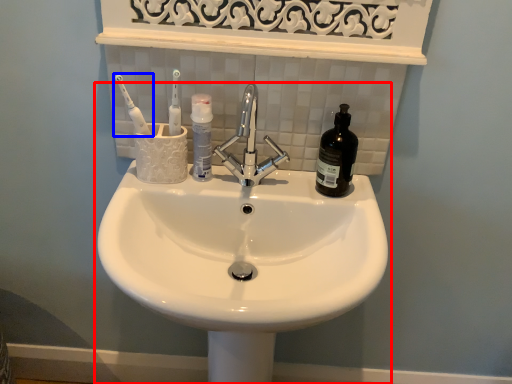
Question: Which object is further to the camera taking this photo, sink (highlighted by a red box) or toothbrush (highlighted by a blue box)?

Choices:
 (A) sink
 (B) toothbrush

Answer: (B)